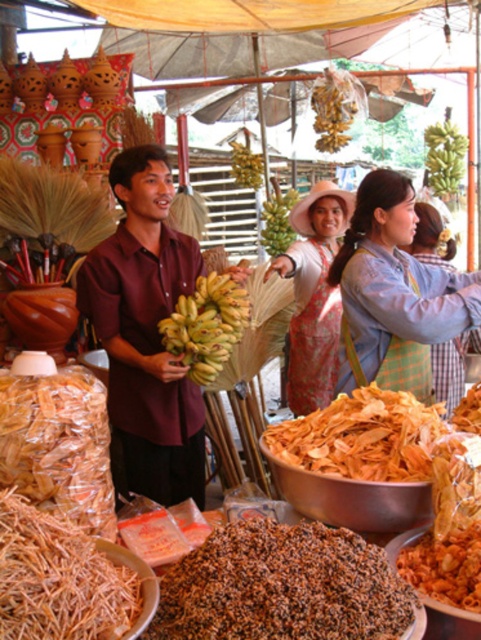
You are a vendor at the market and need to place both the white woven hat at center and the green matte bananas at upper right on a shelf. Which item requires more space due to its size?

The white woven hat at center requires more space because it has a larger size compared to the green matte bananas at upper right.